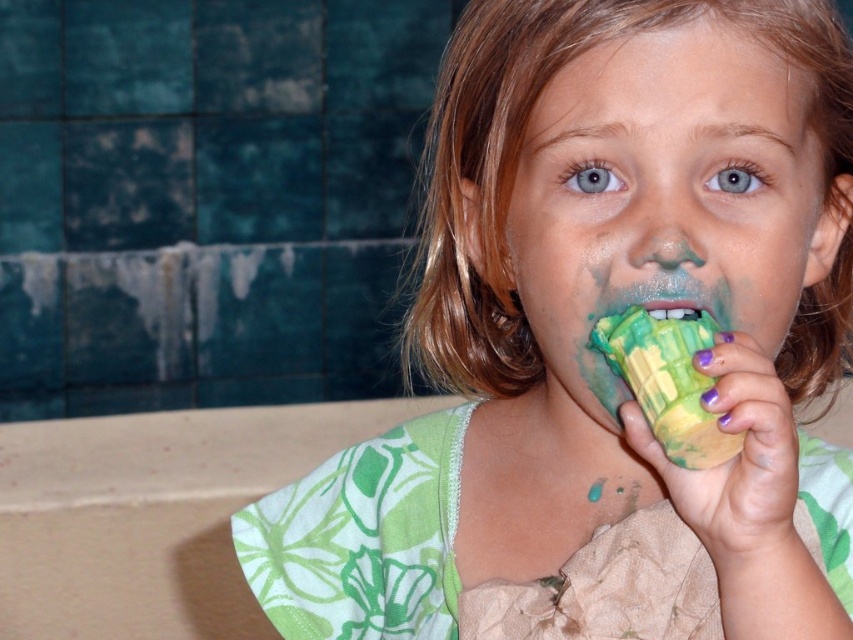
Question: Among these points, which one is nearest to the camera?

Choices:
 (A) (663, 307)
 (B) (486, 419)

Answer: (A)

Question: Does green matte cupcake at center lie behind green painted cup at right?

Choices:
 (A) yes
 (B) no

Answer: (A)

Question: Which object is positioned closest to the green matte ice cream cone at center?

Choices:
 (A) green matte ice cream at center
 (B) green painted cup at right
 (C) green matte cupcake at center
 (D) green rubber toy at mouth

Answer: (C)

Question: Observing the image, what is the correct spatial positioning of green matte cupcake at center in reference to green painted cup at right?

Choices:
 (A) below
 (B) above

Answer: (B)

Question: Is green painted cup at right to the right of green matte ice cream at center from the viewer's perspective?

Choices:
 (A) yes
 (B) no

Answer: (A)

Question: Which object is the closest to the green matte cupcake at center?

Choices:
 (A) green matte ice cream cone at center
 (B) green painted cup at right
 (C) green matte ice cream at center
 (D) green rubber toy at mouth

Answer: (A)